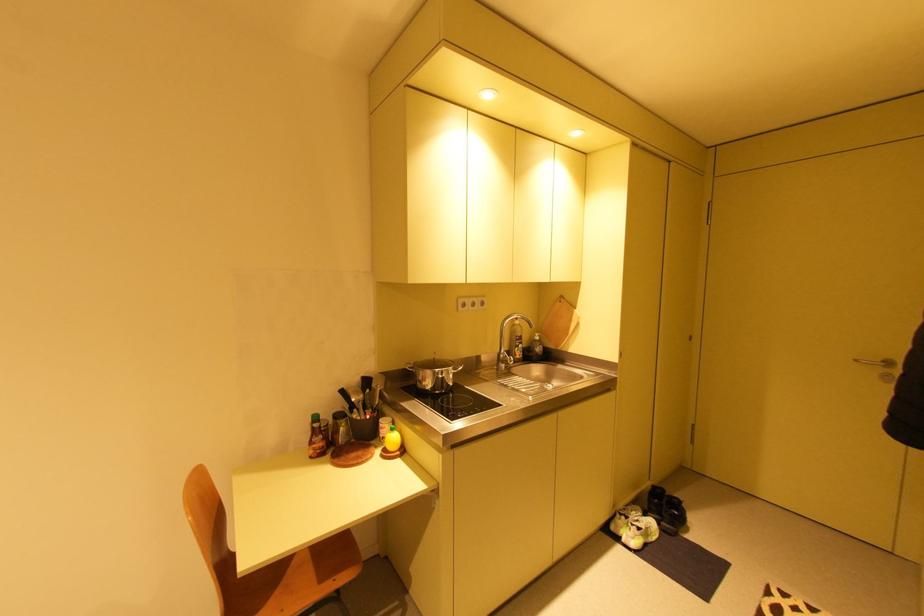
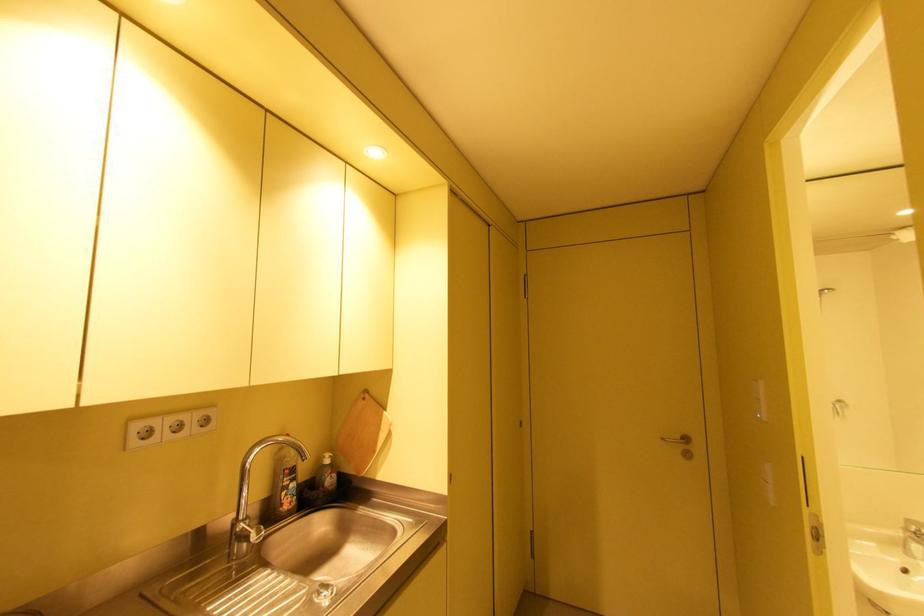
Question: How did the camera likely rotate?

Choices:
 (A) Left
 (B) Right
 (C) Up
 (D) Down

Answer: (B)